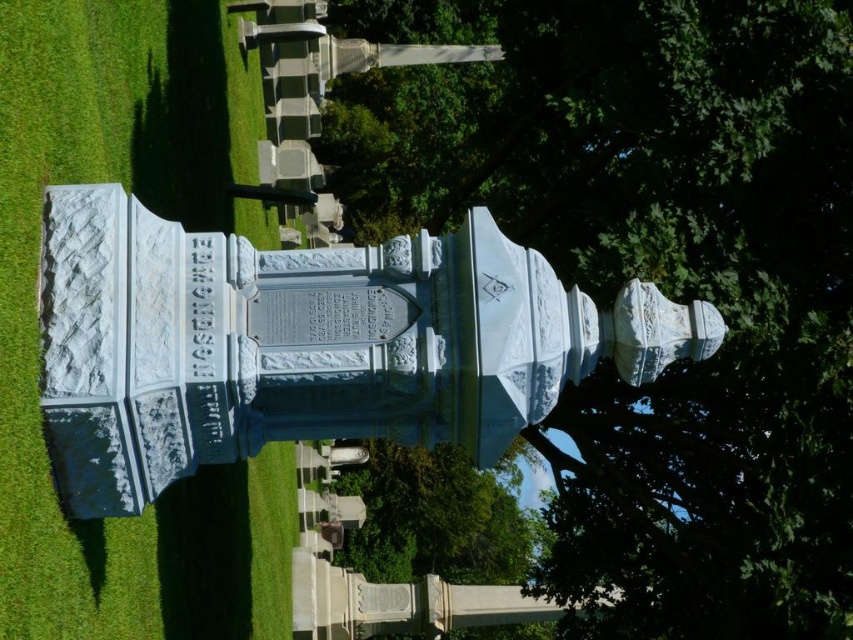
Question: Which point is farther from the camera taking this photo?

Choices:
 (A) (109, 122)
 (B) (430, 522)
 (C) (636, 124)

Answer: (B)

Question: Considering the real-world distances, which object is closest to the green grass at lower left?

Choices:
 (A) green leafy tree at upper center
 (B) green leafy tree at center

Answer: (A)

Question: Is white marble monument at center bigger than green leafy tree at center?

Choices:
 (A) yes
 (B) no

Answer: (B)

Question: Which of the following is the farthest from the observer?

Choices:
 (A) green leafy tree at upper center
 (B) white marble monument at center
 (C) green grass at lower left

Answer: (A)

Question: Considering the relative positions of green grass at lower left and green leafy tree at center in the image provided, where is green grass at lower left located with respect to green leafy tree at center?

Choices:
 (A) above
 (B) below

Answer: (A)

Question: Does green leafy tree at upper center lie in front of green grass at lower left?

Choices:
 (A) no
 (B) yes

Answer: (A)